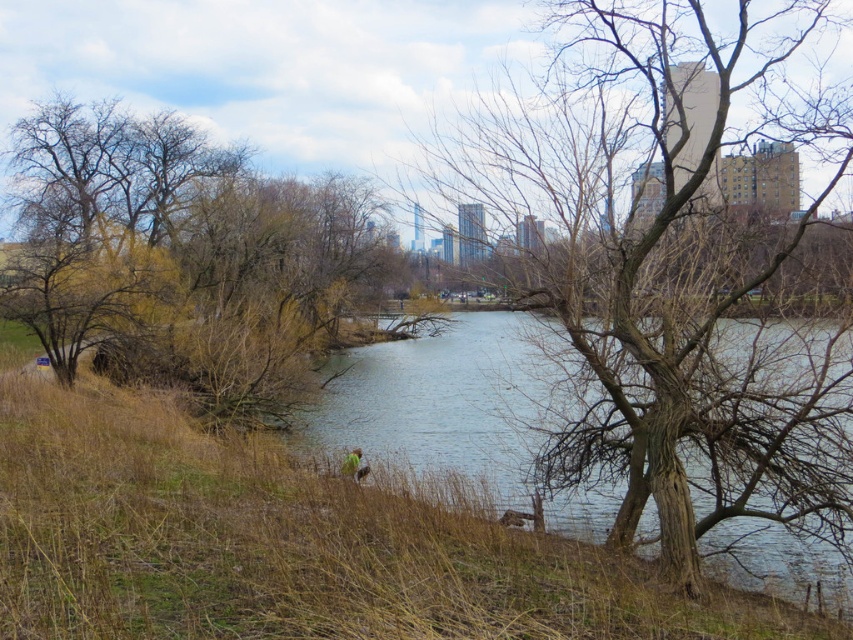
You are a photographer standing on the riverside bank. You want to take a photo of the bare wood tree at center and the clear water at center. If your camera can focus on objects within 10 feet, will you need to move closer to capture both clearly?

The bare wood tree at center is 15.07 feet from clear water at center. Since the camera can only focus within 10 feet, you need to move closer to ensure both are within the 10 feet range.

Based on the photo, you are planning to place a small wooden bench between the bare wood tree at center and the green grass at lower center. The bench requires 6 meters of space. Is there enough space between them to place the bench?

The distance between the bare wood tree at center and the green grass at lower center is 7.12 meters, which is more than the required 6 meters. Therefore, there is enough space to place the bench between them.

Consider the image. You are standing at the riverside and see the bare wood tree at center and the green grass at lower center. Which object is located to the right side of the other?

The bare wood tree at center is to the right of green grass at lower center.